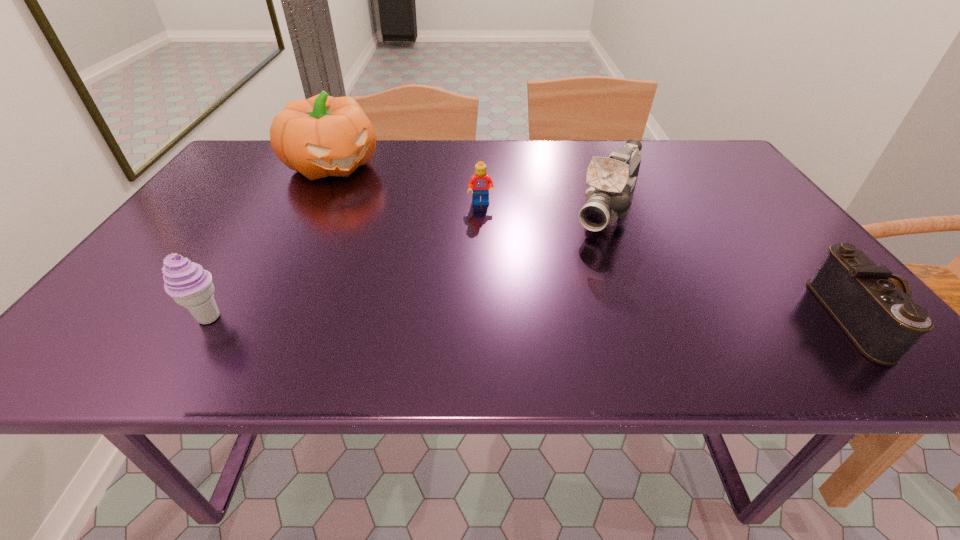
Where is `vacant space on the desktop that is between the icecream and the camera and is positioned on the face of the third object from right to left`? vacant space on the desktop that is between the icecream and the camera and is positioned on the face of the third object from right to left is located at coordinates click(x=493, y=319).

This screenshot has width=960, height=540. What are the coordinates of `vacant space on the desktop that is between the icecream and the camera and is positioned on the carved face of the pumpkin` in the screenshot? It's located at (498, 319).

I want to click on vacant space on the desktop that is between the third tallest object and the rightmost object and is positioned on the front-facing side of the fourth object from left to right, so click(x=538, y=319).